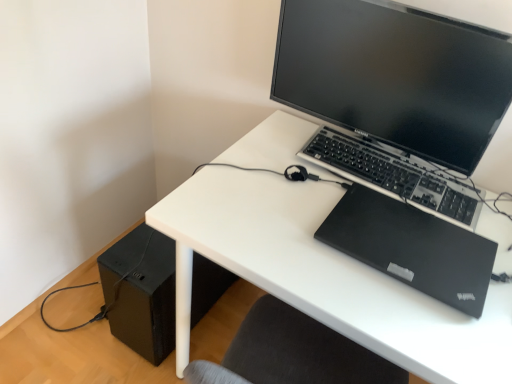
What is the approximate height of black plastic keyboard at center?

2.26 inches.

The width and height of the screenshot is (512, 384). What do you see at coordinates (395, 76) in the screenshot?
I see `matte black monitor at upper center` at bounding box center [395, 76].

What do you see at coordinates (324, 276) in the screenshot? I see `white matte desk at center` at bounding box center [324, 276].

The height and width of the screenshot is (384, 512). Find the location of `black plastic keyboard at center`. black plastic keyboard at center is located at coordinates (393, 176).

Does matte black monitor at upper center lie behind white matte desk at center?

Yes, matte black monitor at upper center is further from the viewer.

Is matte black monitor at upper center wider or thinner than white matte desk at center?

matte black monitor at upper center is thinner than white matte desk at center.

Is matte black monitor at upper center facing towards white matte desk at center?

No, matte black monitor at upper center is not turned towards white matte desk at center.

Is white matte desk at center to the left of black matte laptop at upper right from the viewer's perspective?

Yes.

How distant is white matte desk at center from black matte laptop at upper right?

They are 13.40 centimeters apart.

Is black matte laptop at upper right inside white matte desk at center?

That's correct, black matte laptop at upper right is inside white matte desk at center.

From a real-world perspective, who is located lower, white matte desk at center or black matte laptop at upper right?

From a 3D spatial view, white matte desk at center is below.

Image resolution: width=512 pixels, height=384 pixels. I want to click on desk that appears in front of the matte black monitor at upper center, so click(x=324, y=276).

Which is behind, point (342, 260) or point (409, 110)?

The point (409, 110) is behind.

Between point (470, 203) and point (397, 203), which one is positioned behind?

The point (470, 203) is behind.

Which of these two, black plastic keyboard at center or black matte laptop at upper right, stands taller?

With more height is black plastic keyboard at center.

Choose the correct answer: Is black plastic keyboard at center inside black matte laptop at upper right or outside it?

black plastic keyboard at center lies outside black matte laptop at upper right.

At what (x,y) coordinates should I click in order to perform the action: click on computer monitor above the black plastic keyboard at center (from the image's perspective). Please return your answer as a coordinate pair (x, y). Looking at the image, I should click on (395, 76).

Between black plastic keyboard at center and matte black monitor at upper center, which one has smaller size?

black plastic keyboard at center is smaller.

Considering their positions, is black plastic keyboard at center located in front of or behind matte black monitor at upper center?

black plastic keyboard at center is positioned farther from the viewer than matte black monitor at upper center.

Would you say black plastic keyboard at center is to the left or to the right of matte black monitor at upper center in the picture?

Based on their positions, black plastic keyboard at center is located to the right of matte black monitor at upper center.

Measure the distance between black plastic keyboard at center and white matte desk at center.

7.65 inches.

Considering the positions of objects black plastic keyboard at center and white matte desk at center in the image provided, who is in front, black plastic keyboard at center or white matte desk at center?

white matte desk at center is more forward.

How many degrees apart are the facing directions of black plastic keyboard at center and white matte desk at center?

black plastic keyboard at center and white matte desk at center are facing 3.2 degrees away from each other.

Locate an element on the screen. The height and width of the screenshot is (384, 512). computer keyboard located above the white matte desk at center (from the image's perspective) is located at coordinates (393, 176).

From a real-world perspective, is black matte speaker at lower left physically located above or below black matte laptop at upper right?

black matte speaker at lower left is below black matte laptop at upper right.

Between black matte speaker at lower left and black matte laptop at upper right, which one is positioned behind?

black matte speaker at lower left is further from the camera.

Where is `speaker below the black matte laptop at upper right (from the image's perspective)`? speaker below the black matte laptop at upper right (from the image's perspective) is located at coordinates (141, 292).

Is black matte speaker at lower left bigger or smaller than black matte laptop at upper right?

Clearly, black matte speaker at lower left is larger in size than black matte laptop at upper right.

Identify the location of desk below the matte black monitor at upper center (from a real-world perspective). (324, 276).

Identify the location of laptop that appears on the right of white matte desk at center. The width and height of the screenshot is (512, 384). 412,247.

From the image, which object appears to be nearer to black matte laptop at upper right, matte black monitor at upper center or black matte speaker at lower left?

Among the two, matte black monitor at upper center is located nearer to black matte laptop at upper right.

Based on their spatial positions, is matte black monitor at upper center or black matte speaker at lower left closer to white matte desk at center?

The object closer to white matte desk at center is matte black monitor at upper center.

Which object lies nearer to the anchor point black matte laptop at upper right, black plastic keyboard at center or matte black monitor at upper center?

The object closer to black matte laptop at upper right is black plastic keyboard at center.

Which object lies nearer to the anchor point black matte speaker at lower left, black plastic keyboard at center or matte black monitor at upper center?

Among the two, black plastic keyboard at center is located nearer to black matte speaker at lower left.

When comparing their distances from white matte desk at center, does black matte speaker at lower left or black matte laptop at upper right seem further?

black matte speaker at lower left.

Based on their spatial positions, is white matte desk at center or matte black monitor at upper center further from black matte laptop at upper right?

Based on the image, matte black monitor at upper center appears to be further to black matte laptop at upper right.

Estimate the real-world distances between objects in this image. Which object is closer to black matte speaker at lower left, black matte laptop at upper right or white matte desk at center?

white matte desk at center is closer to black matte speaker at lower left.

Looking at this image, considering their positions, is black matte laptop at upper right positioned closer to matte black monitor at upper center than black plastic keyboard at center?

black plastic keyboard at center lies closer to matte black monitor at upper center than the other object.

At what (x,y) coordinates should I click in order to perform the action: click on computer keyboard between matte black monitor at upper center and white matte desk at center vertically. Please return your answer as a coordinate pair (x, y). Looking at the image, I should click on (393, 176).

I want to click on computer monitor located between black matte speaker at lower left and black plastic keyboard at center in the left-right direction, so click(395, 76).

The height and width of the screenshot is (384, 512). What are the coordinates of `laptop between black matte speaker at lower left and black plastic keyboard at center in the horizontal direction` in the screenshot? It's located at (412, 247).

Identify the location of laptop between matte black monitor at upper center and white matte desk at center in the up-down direction. The height and width of the screenshot is (384, 512). (412, 247).